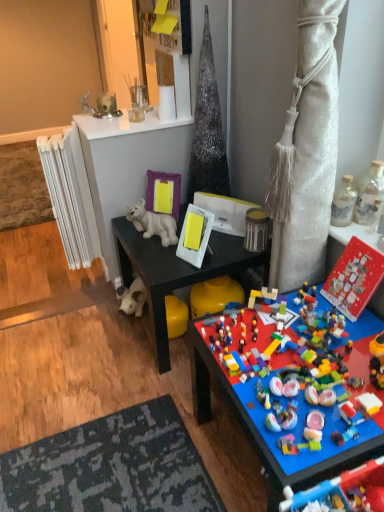
Question: Is multicolored plastic lego pieces at lower right, the 2th toy when ordered from bottom to top, in front of or behind black matte desk at center in the image?

Choices:
 (A) behind
 (B) front

Answer: (B)

Question: In terms of size, does multicolored plastic lego pieces at lower right, which is counted as the seventh toy, starting from the top, appear bigger or smaller than black matte desk at center?

Choices:
 (A) big
 (B) small

Answer: (B)

Question: Which object is positioned farthest from the white metallic radiator at left?

Choices:
 (A) metallic silver canister at upper right, the 4th toy ordered from the bottom
 (B) red matte advent calendar at lower right, positioned as the 3th toy in bottom-to-top order
 (C) clear glass bottles at right, the 7th toy from the bottom
 (D) translucent plastic toy at lower right, marked as the 1th toy in a bottom-to-top arrangement
 (E) purple matte picture frame at upper center, which is the 2th picture frame in bottom-to-top order

Answer: (D)

Question: Which of these objects is positioned closest to the sparkly silver christmas tree at center?

Choices:
 (A) translucent plastic toy at lower right, marked as the 1th toy in a bottom-to-top arrangement
 (B) white plastic picture frame at center, which appears as the first picture frame when viewed from the front
 (C) metallic silver candlestick at upper center, the first toy from the top
 (D) clear glass bottle at upper right, which is the third toy from top to bottom
 (E) white metallic radiator at left

Answer: (B)